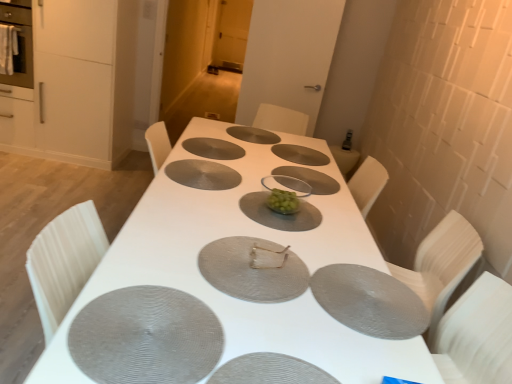
Where is `free space to the back side of gray textured placemat at center, placed as the 7th pizza pan when sorted from back to front`? This screenshot has height=384, width=512. free space to the back side of gray textured placemat at center, placed as the 7th pizza pan when sorted from back to front is located at coordinates (155, 254).